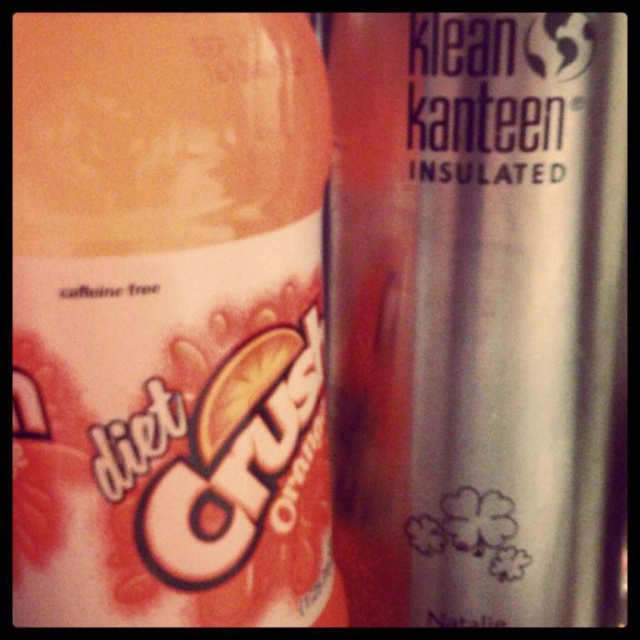
You are organizing a picnic basket and have two bottles to fit side by side. The matte plastic bottle at center and the silver metallic water bottle at right. Which bottle will require less horizontal space when placing them next to each other?

The matte plastic bottle at center has a lesser width compared to the silver metallic water bottle at right, so it will require less horizontal space when placing them next to each other.

You are organizing a picnic basket and need to place the matte plastic bottle at center and the silver metallic water bottle at right. According to the image, which one should you place first to maintain their original positions?

The matte plastic bottle at center should be placed first since it is positioned on the left side of the silver metallic water bottle at right, so placing it first ensures it stays to the left of the other bottle.